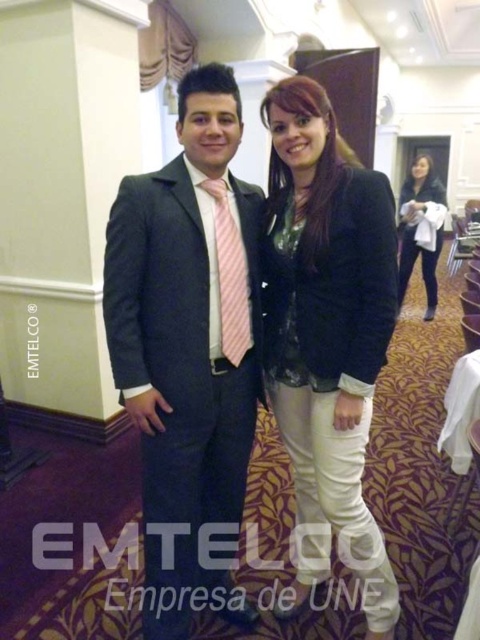
Question: Is matte black blazer at center to the right of pink striped tie at center from the viewer's perspective?

Choices:
 (A) no
 (B) yes

Answer: (B)

Question: Can you confirm if matte black blazer at center is positioned above black leather jacket at upper right?

Choices:
 (A) no
 (B) yes

Answer: (A)

Question: Which object appears farthest from the camera in this image?

Choices:
 (A) matte black suit at center
 (B) matte black blazer at center

Answer: (B)

Question: Is pink striped tie at center wider than black leather jacket at upper right?

Choices:
 (A) yes
 (B) no

Answer: (B)

Question: Estimate the real-world distances between objects in this image. Which object is farther from the matte black blazer at center?

Choices:
 (A) pink striped tie at center
 (B) matte black suit at center

Answer: (A)

Question: Which point is closer to the camera?

Choices:
 (A) matte black blazer at center
 (B) matte black suit at center

Answer: (B)